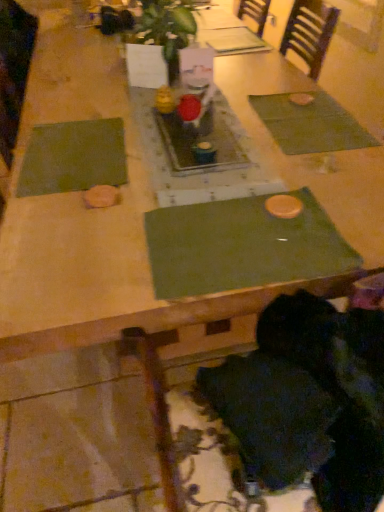
Question: Considering the relative sizes of green leafy plant at center and black fuzzy hair at lower right in the image provided, is green leafy plant at center smaller than black fuzzy hair at lower right?

Choices:
 (A) yes
 (B) no

Answer: (B)

Question: Is green leafy plant at center oriented away from black fuzzy hair at lower right?

Choices:
 (A) yes
 (B) no

Answer: (B)

Question: Is green leafy plant at center taller than black fuzzy hair at lower right?

Choices:
 (A) yes
 (B) no

Answer: (A)

Question: Is green leafy plant at center not close to black fuzzy hair at lower right?

Choices:
 (A) no
 (B) yes

Answer: (B)

Question: Considering the relative positions of green leafy plant at center and black fuzzy hair at lower right in the image provided, is green leafy plant at center to the left of black fuzzy hair at lower right from the viewer's perspective?

Choices:
 (A) yes
 (B) no

Answer: (A)

Question: From their relative heights in the image, would you say green fabric place mat at left, which ranks as the 1th place mat in left-to-right order, is taller or shorter than green fabric place mat at center, which appears as the second place mat when viewed from the left?

Choices:
 (A) tall
 (B) short

Answer: (B)

Question: In terms of width, does green fabric place mat at left, which ranks as the 1th place mat in left-to-right order, look wider or thinner when compared to green fabric place mat at center, which is counted as the 2th place mat, starting from the right?

Choices:
 (A) thin
 (B) wide

Answer: (B)

Question: From a real-world perspective, relative to green fabric place mat at center, which is counted as the 2th place mat, starting from the right, is green fabric place mat at left, which ranks as the 1th place mat in left-to-right order, vertically above or below?

Choices:
 (A) below
 (B) above

Answer: (B)

Question: From the image's perspective, is green fabric place mat at left, which ranks as the 1th place mat in left-to-right order, above or below green fabric place mat at center, which is counted as the 2th place mat, starting from the right?

Choices:
 (A) above
 (B) below

Answer: (A)

Question: From a real-world perspective, is green leafy plant at center above or below black fuzzy hair at lower right?

Choices:
 (A) above
 (B) below

Answer: (A)

Question: Visually, is green leafy plant at center positioned to the left or to the right of black fuzzy hair at lower right?

Choices:
 (A) right
 (B) left

Answer: (B)

Question: Choose the correct answer: Is green leafy plant at center inside black fuzzy hair at lower right or outside it?

Choices:
 (A) outside
 (B) inside

Answer: (A)

Question: Considering their positions, is green leafy plant at center located in front of or behind black fuzzy hair at lower right?

Choices:
 (A) front
 (B) behind

Answer: (B)

Question: From their relative heights in the image, would you say green fabric place mat at center, which is counted as the 2th place mat, starting from the right, is taller or shorter than green fabric placemat at upper right, which is counted as the first place mat, starting from the right?

Choices:
 (A) tall
 (B) short

Answer: (B)

Question: Relative to green fabric placemat at upper right, the 3th place mat viewed from the left, is green fabric place mat at center, which appears as the second place mat when viewed from the left, in front or behind?

Choices:
 (A) front
 (B) behind

Answer: (A)